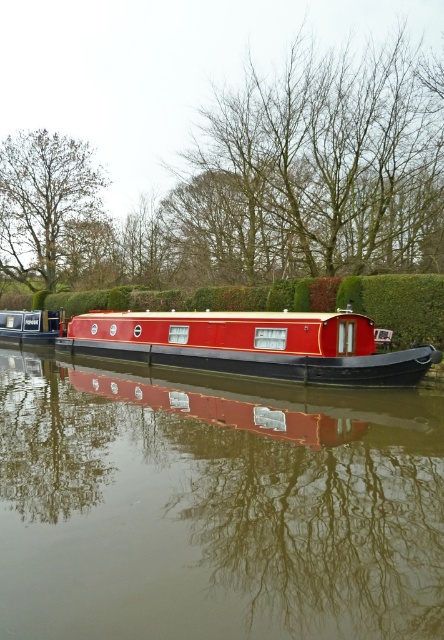
You are standing at the edge of the canal and want to take a photo of both point [348,106] and point [249,323]. Which point should you focus on first to ensure both are in focus?

You should focus on point [348,106] first because it is closer to the camera than point [249,323], ensuring both points are within the depth of field.

You are standing on the dock next to the canal and want to take a photo of the matte black cabin at left without the brown leafy tree at upper left blocking it. How should you position yourself?

You should move to the right side of the dock so that the matte black cabin at left is no longer blocked by the brown leafy tree at upper left since the cabin is behind the tree from your current position.

You are a photographer trying to capture the reflection of the shiny red boat at center in the water. However, there are brown leafless trees at upper center in the way. Based on their positions, will the trees block the reflection of the boat in the water?

→ The brown leafless trees at upper center are positioned over the shiny red boat at center, so their reflection would overlap with the boat in the water, blocking its reflection.